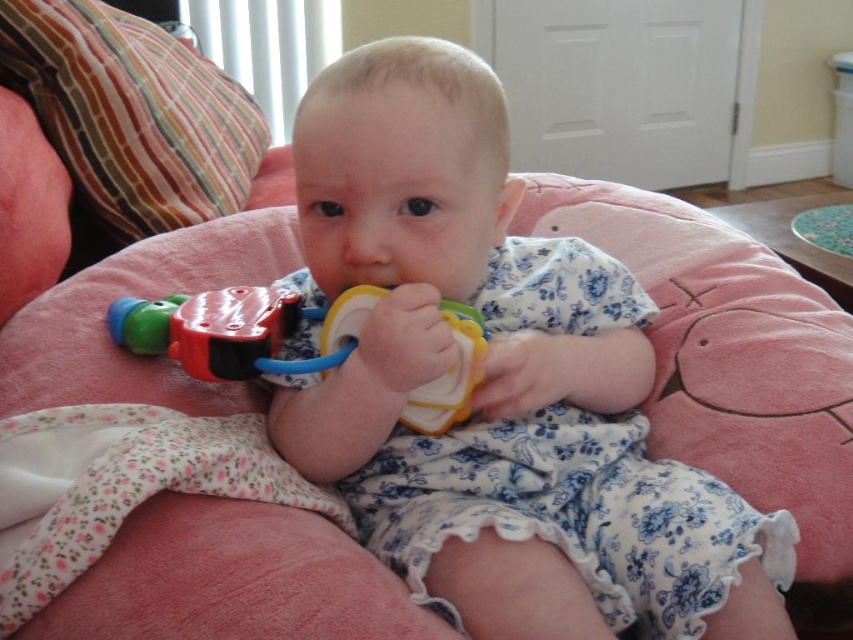
You are a parent holding a baby who is sitting on a pink cushioned chair. The baby is holding a matte plastic toy at center. You want to hand the baby another toy from a shelf that is 24 inches away from you. Can you reach the shelf without moving the baby?

The matte plastic toy at center is 20.37 inches away from the viewer, so yes, you can reach the shelf that is 24 inches away since it is farther than the distance to the matte plastic toy at center.

You are a parent trying to put the striped fabric pillow at upper left back in its place. Where should you place it relative to the matte plastic toy at center?

You should place the striped fabric pillow at upper left above the matte plastic toy at center since the matte plastic toy at center is positioned under it.